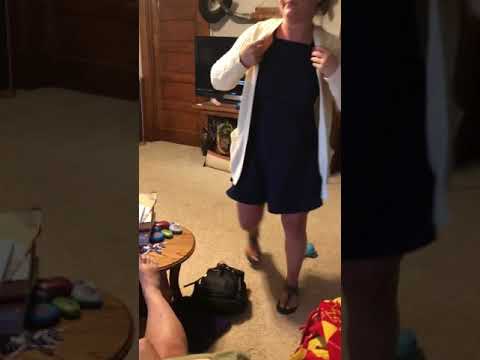
I want to click on television, so click(209, 51).